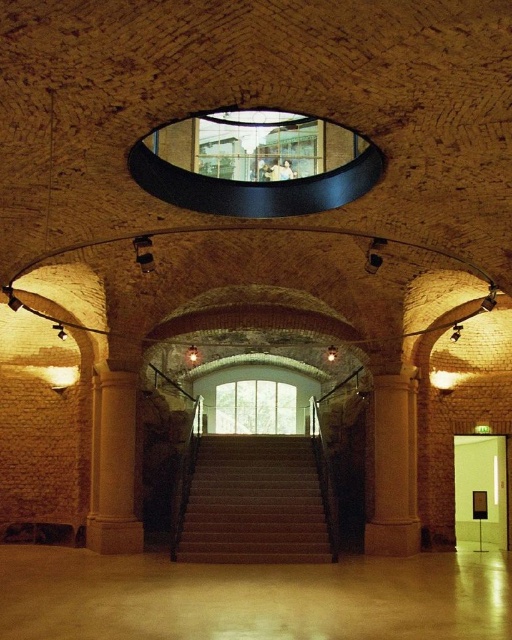
Looking at this image, you are an interior designer planning to place a large sculpture in this historical space. The sculpture requires a base that must be larger than the smooth beige stairs at center but smaller than the sandy stone column at center. Is there a suitable location between these two objects where the sculpture can be placed?

The smooth beige stairs at center has a smaller size compared to sandy stone column at center, so yes, there is a suitable location between them where the sculpture can be placed as the required base size falls between their dimensions.

You are standing in the room and want to walk towards the smooth beige stairs at center and the sandy stone column at center. Which object will you reach first?

You will reach the sandy stone column at center first because it is closer to you than the smooth beige stairs at center, which is further away.

You are a delivery person carrying a large package that is 5 meters long. You need to move it through the space between the sanded concrete floor at lower center and the sandy stone column at center. Can you fit the package through that space without bending it?

The distance between the sanded concrete floor at lower center and the sandy stone column at center is 4.51 meters. Since the package is 5 meters long, it cannot fit through the space as it is longer than the available gap.